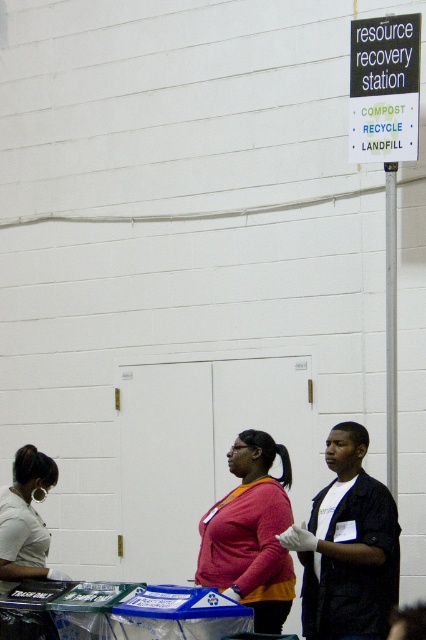
Question: In this image, where is matte pink sweater at center located relative to black plastic sign at upper right?

Choices:
 (A) below
 (B) above

Answer: (A)

Question: Among these points, which one is farthest from the camera?

Choices:
 (A) (382, 129)
 (B) (40, 474)
 (C) (333, 438)
 (D) (235, 538)

Answer: (A)

Question: Which point is farther to the camera?

Choices:
 (A) (8, 554)
 (B) (391, 90)
 (C) (304, 529)

Answer: (B)

Question: Observing the image, what is the correct spatial positioning of black matte shirt at center in reference to matte white shirt at lower left?

Choices:
 (A) below
 (B) above

Answer: (B)

Question: Which of the following is the farthest from the observer?

Choices:
 (A) black plastic sign at upper right
 (B) black matte shirt at center
 (C) matte pink sweater at center

Answer: (A)

Question: Does black matte shirt at center have a greater width compared to matte pink sweater at center?

Choices:
 (A) yes
 (B) no

Answer: (A)